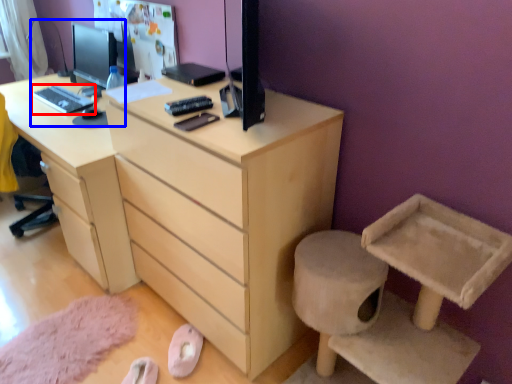
Question: Among these objects, which one is farthest to the camera, desktop (highlighted by a red box) or desktop computer (highlighted by a blue box)?

Choices:
 (A) desktop
 (B) desktop computer

Answer: (A)